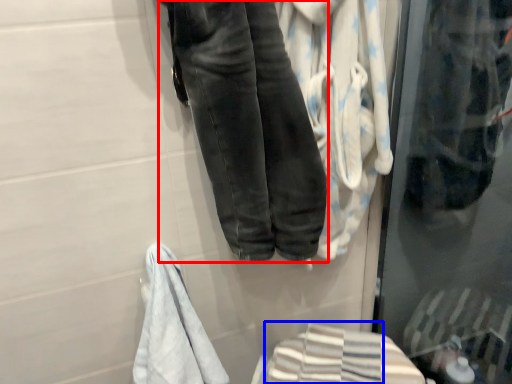
Question: Which object is closer to the camera taking this photo, trousers (highlighted by a red box) or bath towel (highlighted by a blue box)?

Choices:
 (A) trousers
 (B) bath towel

Answer: (A)